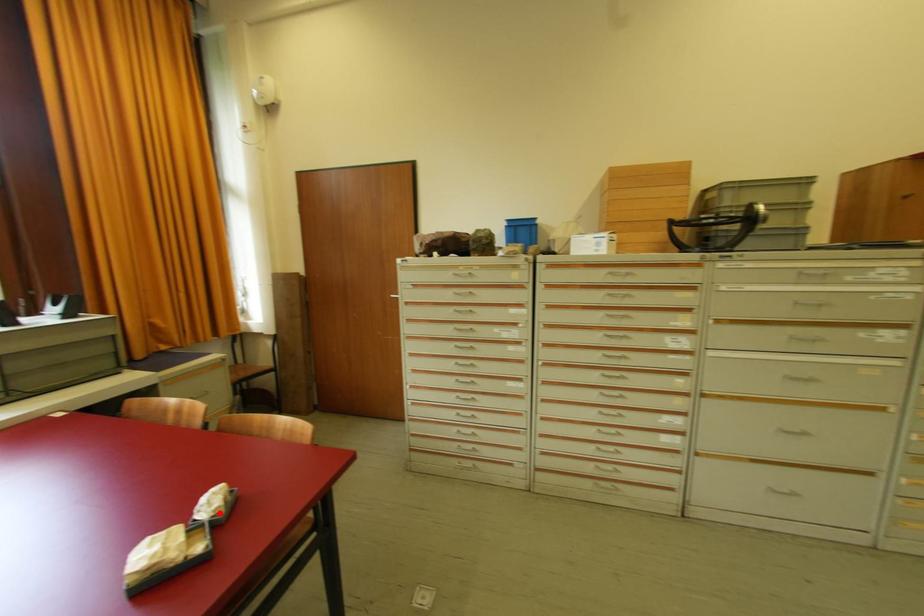
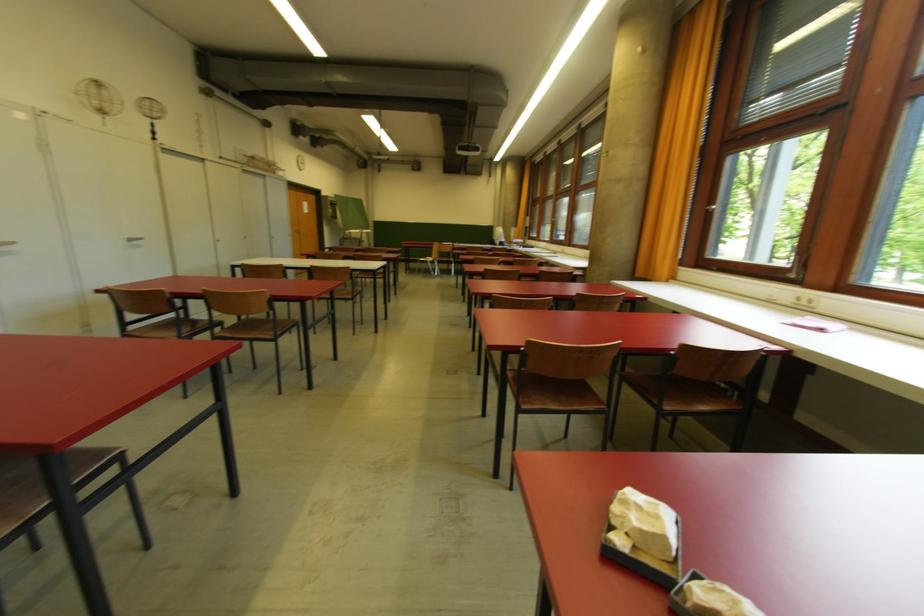
Question: I am providing you with two images of the same scene from different viewpoints. A red point is marked on the first image. Is the red point's position out of view in image 2?

Choices:
 (A) Yes
 (B) No

Answer: (B)